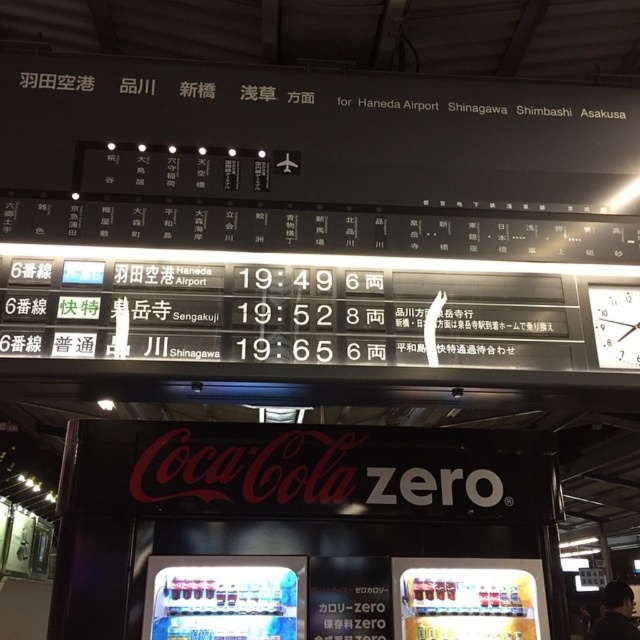
Consider the image. Is metallic silver vending machine at center shorter than metallic silver vending machine at lower right?

Incorrect, metallic silver vending machine at center's height does not fall short of metallic silver vending machine at lower right's.

The width and height of the screenshot is (640, 640). What do you see at coordinates (225, 596) in the screenshot?
I see `metallic silver vending machine at center` at bounding box center [225, 596].

Locate an element on the screen. metallic silver vending machine at center is located at coordinates pos(225,596).

Which is below, black plastic coca-cola zero at center or white plastic clock at upper right?

black plastic coca-cola zero at center is below.

Is black plastic coca-cola zero at center positioned before white plastic clock at upper right?

No, black plastic coca-cola zero at center is further to the viewer.

At what (x,y) coordinates should I click in order to perform the action: click on black plastic coca-cola zero at center. Please return your answer as a coordinate pair (x, y). The width and height of the screenshot is (640, 640). Looking at the image, I should click on (289, 502).

Is white plastic scoreboard at upper center in front of metallic silver vending machine at lower right?

That is True.

Between white plastic scoreboard at upper center and metallic silver vending machine at lower right, which one appears on the right side from the viewer's perspective?

metallic silver vending machine at lower right is more to the right.

In order to click on white plastic scoreboard at upper center in this screenshot , I will do `click(310, 230)`.

This screenshot has height=640, width=640. What are the coordinates of `white plastic scoreboard at upper center` in the screenshot? It's located at (310, 230).